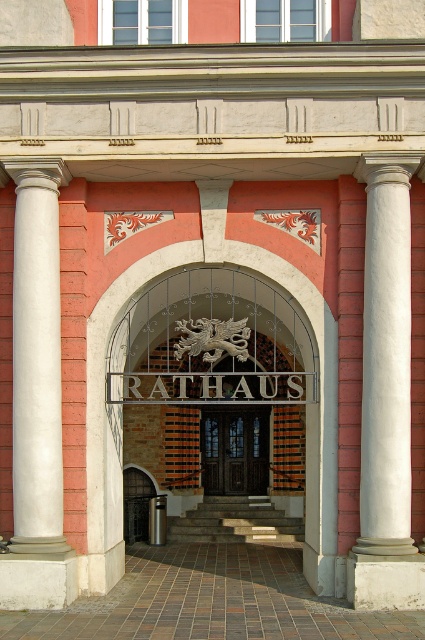
Question: Estimate the real-world distances between objects in this image. Which object is farther from the white marble column at left?

Choices:
 (A) dark wood door at center
 (B) white marble column at center

Answer: (A)

Question: Can you confirm if white marble column at left is thinner than dark wood door at center?

Choices:
 (A) yes
 (B) no

Answer: (A)

Question: Estimate the real-world distances between objects in this image. Which object is farther from the white marble column at center?

Choices:
 (A) dark wood door at center
 (B) white marble column at left

Answer: (A)

Question: Which object appears closest to the camera in this image?

Choices:
 (A) white marble column at left
 (B) dark wood door at center
 (C) white marble column at center

Answer: (C)

Question: Does white marble column at center appear on the left side of dark wood door at center?

Choices:
 (A) no
 (B) yes

Answer: (A)

Question: Does white marble column at center have a smaller size compared to dark wood door at center?

Choices:
 (A) yes
 (B) no

Answer: (B)